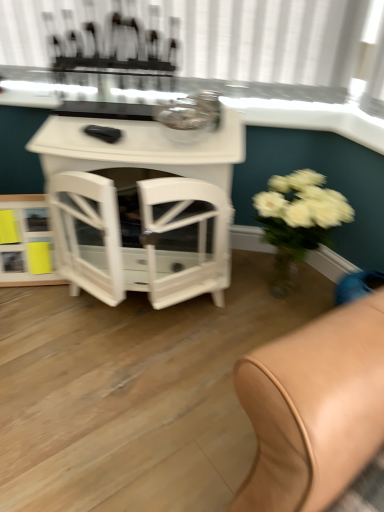
This screenshot has width=384, height=512. What do you see at coordinates (297, 220) in the screenshot?
I see `white matte vase at right` at bounding box center [297, 220].

What is the approximate height of white matte vase at right?

The height of white matte vase at right is 18.79 inches.

The width and height of the screenshot is (384, 512). I want to click on clear glass table at upper center, so click(278, 40).

In the scene shown: What is the approximate height of white glossy shelf at lower left?

white glossy shelf at lower left is 13.54 inches in height.

What do you see at coordinates (26, 242) in the screenshot? The width and height of the screenshot is (384, 512). I see `white glossy shelf at lower left` at bounding box center [26, 242].

Describe the element at coordinates (221, 101) in the screenshot. I see `white glossy window sill at upper center` at that location.

Locate an element on the screen. This screenshot has width=384, height=512. white matte vase at right is located at coordinates (297, 220).

Is point (225, 112) closer to viewer compared to point (304, 22)?

Yes, it is.

Considering the relative positions of white glossy table at center and clear glass table at upper center in the image provided, is white glossy table at center to the left or to the right of clear glass table at upper center?

Clearly, white glossy table at center is on the left of clear glass table at upper center in the image.

Looking at their sizes, would you say white glossy table at center is wider or thinner than clear glass table at upper center?

white glossy table at center is wider than clear glass table at upper center.

Does white glossy table at center have a greater height compared to clear glass table at upper center?

Correct, white glossy table at center is much taller as clear glass table at upper center.

Considering the positions of objects white matte vase at right and white glossy shelf at lower left in the image provided, who is behind, white matte vase at right or white glossy shelf at lower left?

white glossy shelf at lower left is more distant.

From a real-world perspective, does white matte vase at right sit lower than white glossy shelf at lower left?

No.

Is white matte vase at right located outside white glossy shelf at lower left?

Yes, white matte vase at right is outside of white glossy shelf at lower left.

Is white glossy window sill at upper center to the right of white matte vase at right from the viewer's perspective?

No, white glossy window sill at upper center is not to the right of white matte vase at right.

Consider the image. From the image's perspective, is white glossy window sill at upper center above white matte vase at right?

Yes.

Is white glossy window sill at upper center not inside white matte vase at right?

Yes.

From the image's perspective, is white glossy window sill at upper center above clear glass table at upper center?

No.

Where is `bay window above the white glossy window sill at upper center (from a real-world perspective)`? The image size is (384, 512). bay window above the white glossy window sill at upper center (from a real-world perspective) is located at coordinates (278, 40).

What's the angular difference between white glossy window sill at upper center and clear glass table at upper center's facing directions?

0.286 degrees.

Relative to white glossy shelf at lower left, is white glossy table at center in front or behind?

white glossy table at center is positioned closer to the viewer than white glossy shelf at lower left.

From a real-world perspective, between white glossy table at center and white glossy shelf at lower left, who is vertically higher?

white glossy table at center, from a real-world perspective.

Is white glossy table at center bigger than white glossy shelf at lower left?

Correct, white glossy table at center is larger in size than white glossy shelf at lower left.

Is white glossy shelf at lower left oriented away from white glossy table at center?

No.

Is white glossy shelf at lower left smaller than white glossy table at center?

Correct, white glossy shelf at lower left occupies less space than white glossy table at center.

Does white glossy shelf at lower left have a lesser width compared to white glossy table at center?

Yes, white glossy shelf at lower left is thinner than white glossy table at center.

Considering the relative sizes of white matte vase at right and white glossy window sill at upper center in the image provided, is white matte vase at right taller than white glossy window sill at upper center?

Yes.

Is white matte vase at right thinner than white glossy window sill at upper center?

No, white matte vase at right is not thinner than white glossy window sill at upper center.

Where is `window sill above the white matte vase at right (from a real-world perspective)`? The image size is (384, 512). window sill above the white matte vase at right (from a real-world perspective) is located at coordinates (221, 101).

Considering the positions of objects white matte vase at right and white glossy window sill at upper center in the image provided, who is more to the left, white matte vase at right or white glossy window sill at upper center?

Positioned to the left is white glossy window sill at upper center.

At what (x,y) coordinates should I click in order to perform the action: click on bay window above the white glossy table at center (from a real-world perspective). Please return your answer as a coordinate pair (x, y). This screenshot has height=512, width=384. Looking at the image, I should click on (278, 40).

Identify the location of shelf that appears below the white matte vase at right (from a real-world perspective). This screenshot has width=384, height=512. (26, 242).

From the image, which object appears to be nearer to white glossy shelf at lower left, white glossy window sill at upper center or white matte vase at right?

The object closer to white glossy shelf at lower left is white glossy window sill at upper center.

Which object lies nearer to the anchor point white glossy shelf at lower left, white glossy table at center or white matte vase at right?

Based on the image, white glossy table at center appears to be nearer to white glossy shelf at lower left.

Based on their spatial positions, is white glossy table at center or white glossy window sill at upper center further from clear glass table at upper center?

Among the two, white glossy table at center is located further to clear glass table at upper center.

Considering their positions, is white glossy shelf at lower left positioned further to white glossy window sill at upper center than clear glass table at upper center?

The object further to white glossy window sill at upper center is white glossy shelf at lower left.

Which object lies further to the anchor point white glossy shelf at lower left, white glossy window sill at upper center or white glossy table at center?

white glossy window sill at upper center is positioned further to the anchor white glossy shelf at lower left.

From the image, which object appears to be farther from white glossy table at center, white glossy shelf at lower left or white glossy window sill at upper center?

Based on the image, white glossy shelf at lower left appears to be further to white glossy table at center.

Based on their spatial positions, is white glossy shelf at lower left or clear glass table at upper center closer to white matte vase at right?

Based on the image, clear glass table at upper center appears to be nearer to white matte vase at right.

Consider the image. Based on their spatial positions, is clear glass table at upper center or white glossy shelf at lower left closer to white matte vase at right?

clear glass table at upper center.

Image resolution: width=384 pixels, height=512 pixels. What are the coordinates of `window sill between white glossy table at center and white matte vase at right` in the screenshot? It's located at (221, 101).

Identify the location of window sill situated between white glossy shelf at lower left and white matte vase at right from left to right. Image resolution: width=384 pixels, height=512 pixels. (221, 101).

The width and height of the screenshot is (384, 512). In order to click on table between white glossy shelf at lower left and white matte vase at right from left to right in this screenshot , I will do `click(143, 148)`.

The image size is (384, 512). In order to click on table between white glossy shelf at lower left and white glossy window sill at upper center from left to right in this screenshot , I will do `click(143, 148)`.